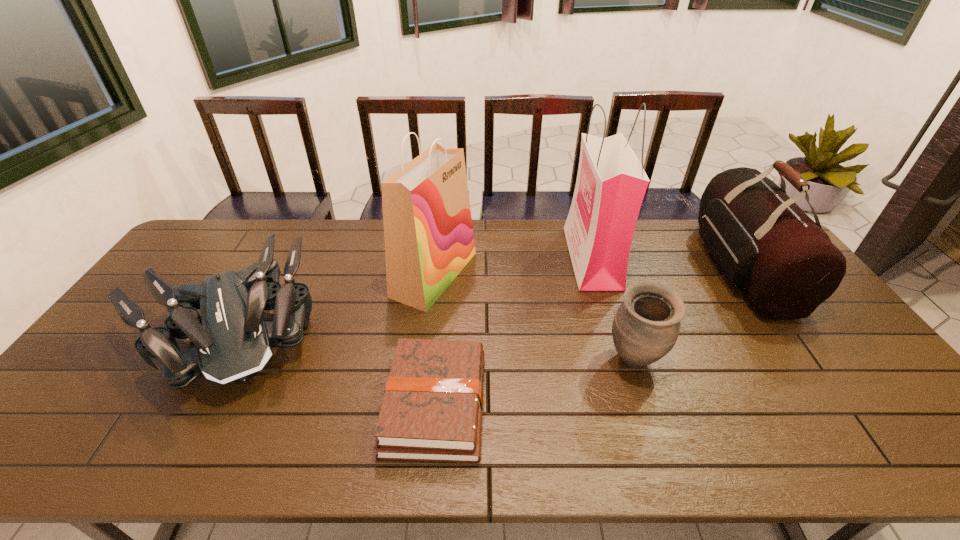
Where is `vacant region that satisfies the following two spatial constraints: 1. on the back side of the urn; 2. on the right side of the hardback book`? vacant region that satisfies the following two spatial constraints: 1. on the back side of the urn; 2. on the right side of the hardback book is located at coordinates (440, 360).

Find the location of a particular element. Image resolution: width=960 pixels, height=540 pixels. free space that satisfies the following two spatial constraints: 1. on the back side of the left shopping bag; 2. on the left side of the drone is located at coordinates (260, 274).

Find the location of a particular element. vacant space that satisfies the following two spatial constraints: 1. on the front pocket of the duffel bag; 2. on the front side of the shortest object is located at coordinates (836, 404).

The height and width of the screenshot is (540, 960). I want to click on free space that satisfies the following two spatial constraints: 1. on the front side of the hardback book; 2. on the right side of the left shopping bag, so click(x=419, y=404).

Where is `vacant point that satisfies the following two spatial constraints: 1. on the front-facing side of the right shopping bag; 2. on the front side of the drone`? This screenshot has height=540, width=960. vacant point that satisfies the following two spatial constraints: 1. on the front-facing side of the right shopping bag; 2. on the front side of the drone is located at coordinates point(614,332).

I want to click on vacant space that satisfies the following two spatial constraints: 1. on the front-facing side of the right shopping bag; 2. on the right side of the urn, so click(623, 360).

The image size is (960, 540). I want to click on free space that satisfies the following two spatial constraints: 1. on the front-facing side of the urn; 2. on the right side of the right shopping bag, so click(623, 360).

The height and width of the screenshot is (540, 960). What are the coordinates of `free space that satisfies the following two spatial constraints: 1. on the front side of the fourth tallest object; 2. on the right side of the drone` in the screenshot? It's located at [211, 360].